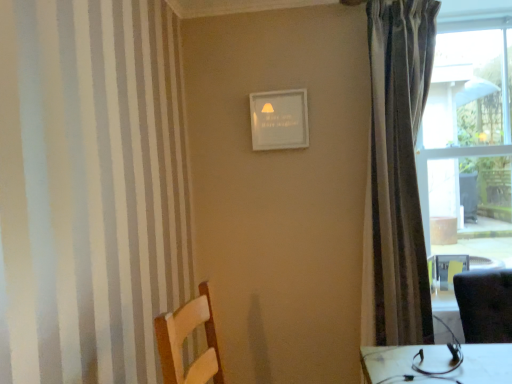
This screenshot has width=512, height=384. What do you see at coordinates (469, 140) in the screenshot?
I see `transparent glass window at right` at bounding box center [469, 140].

Identify the location of transparent glass window at right. (469, 140).

In order to face transparent glass window at right, should I rotate leftwards or rightwards?

A 26.941 degree turn to the right will do.

Describe the element at coordinates (399, 166) in the screenshot. The width and height of the screenshot is (512, 384). I see `silky gray curtain at right` at that location.

Find the location of a particular element. silky gray curtain at right is located at coordinates (399, 166).

Where is `transparent glass window at right`? Image resolution: width=512 pixels, height=384 pixels. transparent glass window at right is located at coordinates (469, 140).

Is transparent glass window at right to the left of silky gray curtain at right from the viewer's perspective?

In fact, transparent glass window at right is to the right of silky gray curtain at right.

Considering the positions of objects transparent glass window at right and silky gray curtain at right in the image provided, who is in front, transparent glass window at right or silky gray curtain at right?

Positioned in front is silky gray curtain at right.

Considering the points (444, 190) and (373, 246), which point is behind, point (444, 190) or point (373, 246)?

The point (444, 190) is more distant.

From the image's perspective, which is below, transparent glass window at right or silky gray curtain at right?

silky gray curtain at right, from the image's perspective.

From a real-world perspective, does transparent glass window at right sit lower than silky gray curtain at right?

No, from a real-world perspective, transparent glass window at right is not beneath silky gray curtain at right.

Between transparent glass window at right and silky gray curtain at right, which one has larger width?

Wider between the two is transparent glass window at right.

Is transparent glass window at right taller or shorter than silky gray curtain at right?

Considering their sizes, transparent glass window at right has less height than silky gray curtain at right.

Who is smaller, transparent glass window at right or silky gray curtain at right?

silky gray curtain at right.

Do you think transparent glass window at right is within silky gray curtain at right, or outside of it?

transparent glass window at right is outside silky gray curtain at right.

Is transparent glass window at right with silky gray curtain at right?

No, transparent glass window at right is not next to silky gray curtain at right.

Is transparent glass window at right aimed at silky gray curtain at right?

No, transparent glass window at right is not turned towards silky gray curtain at right.

How many degrees apart are the facing directions of transparent glass window at right and silky gray curtain at right?

The facing directions of transparent glass window at right and silky gray curtain at right are 83 degrees apart.

Measure the distance between transparent glass window at right and silky gray curtain at right.

transparent glass window at right and silky gray curtain at right are 26.38 inches apart.

Locate an element on the screen. The height and width of the screenshot is (384, 512). curtain that appears below the transparent glass window at right (from the image's perspective) is located at coordinates (399, 166).

Which is more to the right, silky gray curtain at right or transparent glass window at right?

Positioned to the right is transparent glass window at right.

Which is in front, silky gray curtain at right or transparent glass window at right?

silky gray curtain at right is in front.

Does point (377, 273) come closer to viewer compared to point (428, 129)?

Yes, point (377, 273) is in front of point (428, 129).

From the image's perspective, does silky gray curtain at right appear higher than transparent glass window at right?

Incorrect, from the image's perspective, silky gray curtain at right is lower than transparent glass window at right.

From a real-world perspective, is silky gray curtain at right below transparent glass window at right?

Yes, from a real-world perspective, silky gray curtain at right is beneath transparent glass window at right.

Considering the sizes of objects silky gray curtain at right and transparent glass window at right in the image provided, who is wider, silky gray curtain at right or transparent glass window at right?

Wider between the two is transparent glass window at right.

Does silky gray curtain at right have a lesser height compared to transparent glass window at right?

No, silky gray curtain at right is not shorter than transparent glass window at right.

Who is smaller, silky gray curtain at right or transparent glass window at right?

Smaller between the two is silky gray curtain at right.

Is silky gray curtain at right positioned beyond the bounds of transparent glass window at right?

Yes.

Is there a large distance between silky gray curtain at right and transparent glass window at right?

silky gray curtain at right is actually quite close to transparent glass window at right.

Is silky gray curtain at right facing towards transparent glass window at right?

No, silky gray curtain at right does not turn towards transparent glass window at right.

How many degrees apart are the facing directions of silky gray curtain at right and transparent glass window at right?

The facing directions of silky gray curtain at right and transparent glass window at right are 83 degrees apart.

The image size is (512, 384). What are the coordinates of `window above the silky gray curtain at right (from a real-world perspective)` in the screenshot? It's located at (469, 140).

Identify the location of window above the silky gray curtain at right (from a real-world perspective). (469, 140).

The image size is (512, 384). Identify the location of window to the right of silky gray curtain at right. (469, 140).